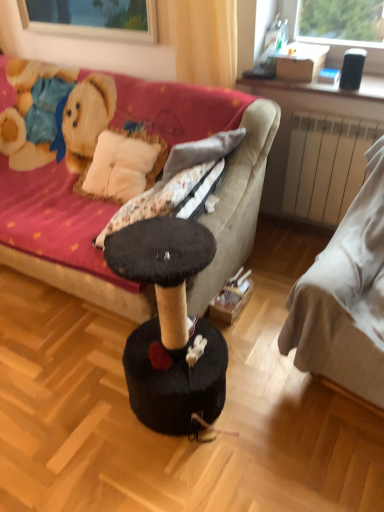
Question: Is white fabric bed at right, which is the 2th studio couch in left-to-right order, behind white matte radiator at right?

Choices:
 (A) no
 (B) yes

Answer: (A)

Question: Is white fabric bed at right, which is the 2th studio couch in left-to-right order, turned away from white matte radiator at right?

Choices:
 (A) yes
 (B) no

Answer: (B)

Question: Does white fabric bed at right, acting as the first studio couch starting from the right, appear on the left side of white matte radiator at right?

Choices:
 (A) yes
 (B) no

Answer: (B)

Question: Is white fabric bed at right, acting as the first studio couch starting from the right, positioned in front of white matte radiator at right?

Choices:
 (A) yes
 (B) no

Answer: (A)

Question: From the image's perspective, would you say white fabric bed at right, which is the 2th studio couch in left-to-right order, is shown under white matte radiator at right?

Choices:
 (A) no
 (B) yes

Answer: (B)

Question: Considering their positions, is transparent glass window at upper center located in front of or behind white matte radiator at right?

Choices:
 (A) behind
 (B) front

Answer: (A)

Question: Does point (59, 11) appear closer or farther from the camera than point (288, 168)?

Choices:
 (A) closer
 (B) farther

Answer: (B)

Question: Which is correct: transparent glass window at upper center is inside white matte radiator at right, or outside of it?

Choices:
 (A) inside
 (B) outside

Answer: (B)

Question: From a real-world perspective, is transparent glass window at upper center physically located above or below white matte radiator at right?

Choices:
 (A) above
 (B) below

Answer: (A)

Question: Which is correct: velvet fabric couch at center, positioned as the first studio couch in left-to-right order, is inside transparent glass window at upper center, or outside of it?

Choices:
 (A) outside
 (B) inside

Answer: (A)

Question: Is velvet fabric couch at center, positioned as the first studio couch in left-to-right order, wider or thinner than transparent glass window at upper center?

Choices:
 (A) thin
 (B) wide

Answer: (B)

Question: Considering the positions of velvet fabric couch at center, positioned as the first studio couch in left-to-right order, and transparent glass window at upper center in the image, is velvet fabric couch at center, positioned as the first studio couch in left-to-right order, bigger or smaller than transparent glass window at upper center?

Choices:
 (A) big
 (B) small

Answer: (A)

Question: From a real-world perspective, is velvet fabric couch at center, which is the 2th studio couch from right to left, above or below transparent glass window at upper center?

Choices:
 (A) below
 (B) above

Answer: (A)

Question: In terms of width, does velvet fabric couch at center, positioned as the first studio couch in left-to-right order, look wider or thinner when compared to white matte radiator at right?

Choices:
 (A) thin
 (B) wide

Answer: (B)

Question: Looking at the image, does velvet fabric couch at center, positioned as the first studio couch in left-to-right order, seem bigger or smaller compared to white matte radiator at right?

Choices:
 (A) big
 (B) small

Answer: (A)